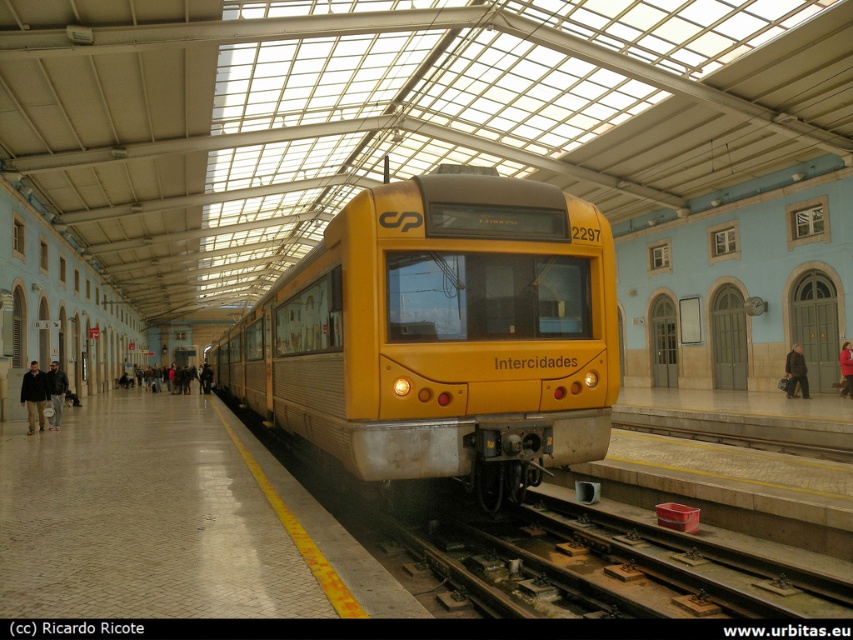
Who is positioned more to the left, metallic track at center or red wool coat at right?

From the viewer's perspective, metallic track at center appears more on the left side.

Consider the image. Can you confirm if metallic track at center is taller than red wool coat at right?

Incorrect, metallic track at center's height is not larger of red wool coat at right's.

This screenshot has width=853, height=640. Describe the element at coordinates (610, 560) in the screenshot. I see `metallic track at center` at that location.

What are the coordinates of `metallic track at center` in the screenshot? It's located at (610, 560).

Find the location of `dark gray jacket at left`. dark gray jacket at left is located at coordinates (56, 392).

Can you confirm if dark gray jacket at left is taller than light brown leather jacket at center?

No.

This screenshot has width=853, height=640. I want to click on dark gray jacket at left, so click(x=56, y=392).

Locate an element on the screen. The width and height of the screenshot is (853, 640). dark gray jacket at left is located at coordinates coord(56,392).

Is smooth concrete platform at center behind red wool coat at right?

No, it is in front of red wool coat at right.

Which is below, smooth concrete platform at center or red wool coat at right?

Positioned lower is smooth concrete platform at center.

Where is `smooth concrete platform at center`? Image resolution: width=853 pixels, height=640 pixels. smooth concrete platform at center is located at coordinates (171, 522).